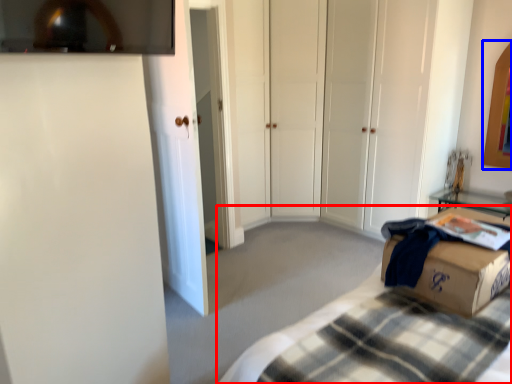
Question: Which of the following is the farthest to the observer, bed (highlighted by a red box) or picture frame (highlighted by a blue box)?

Choices:
 (A) bed
 (B) picture frame

Answer: (B)